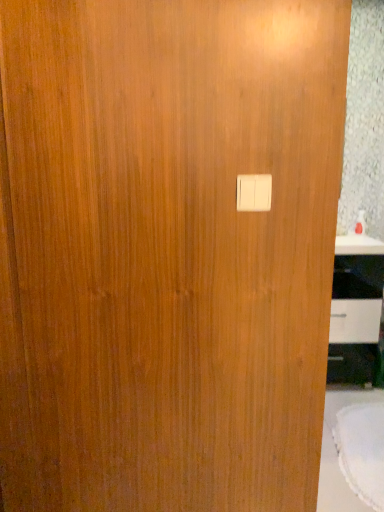
Locate an element on the screen. This screenshot has width=384, height=512. white glossy cabinet at right is located at coordinates (356, 321).

Describe the element at coordinates (356, 321) in the screenshot. I see `white glossy cabinet at right` at that location.

Identify the location of white plastic light switch at center. (254, 192).

From the image's perspective, does white plastic light switch at center appear lower than white fabric table at lower right?

No, from the image's perspective, white plastic light switch at center is not below white fabric table at lower right.

From a real-world perspective, is white plastic light switch at center located beneath white fabric table at lower right?

No, from a real-world perspective, white plastic light switch at center is not below white fabric table at lower right.

Choose the correct answer: Is white plastic light switch at center inside white fabric table at lower right or outside it?

white plastic light switch at center is not enclosed by white fabric table at lower right.

The width and height of the screenshot is (384, 512). In order to click on light switch in front of the white fabric table at lower right in this screenshot , I will do `click(254, 192)`.

Considering the sizes of objects white fabric table at lower right and white glossy cabinet at right in the image provided, who is wider, white fabric table at lower right or white glossy cabinet at right?

white fabric table at lower right.

How different are the orientations of white fabric table at lower right and white glossy cabinet at right in degrees?

They differ by 0.000441 degrees in their facing directions.

From the image's perspective, which is below, white fabric table at lower right or white glossy cabinet at right?

white fabric table at lower right is shown below in the image.

Based on the photo, is white fabric table at lower right not close to white glossy cabinet at right?

No, white fabric table at lower right is not far from white glossy cabinet at right.

From a real-world perspective, which object rests below the other?

white glossy cabinet at right, from a real-world perspective.

Is white glossy cabinet at right at the back of white plastic light switch at center?

white plastic light switch at center is not turned away from white glossy cabinet at right.

Is white plastic light switch at center next to white glossy cabinet at right and touching it?

No, white plastic light switch at center is not making contact with white glossy cabinet at right.

Which object is further away from the camera taking this photo, white plastic light switch at center or white glossy cabinet at right?

white glossy cabinet at right is behind.

Can you tell me how much white glossy cabinet at right and white fabric table at lower right differ in facing direction?

white glossy cabinet at right and white fabric table at lower right are facing 0.000441 degrees away from each other.

Considering the positions of objects white glossy cabinet at right and white fabric table at lower right in the image provided, who is more to the left, white glossy cabinet at right or white fabric table at lower right?

Positioned to the left is white fabric table at lower right.

Is white glossy cabinet at right outside of white fabric table at lower right?

Yes.

How many degrees apart are the facing directions of white fabric table at lower right and white plastic light switch at center?

1.01 degrees separate the facing orientations of white fabric table at lower right and white plastic light switch at center.

Choose the correct answer: Is white fabric table at lower right inside white plastic light switch at center or outside it?

The correct answer is: outside.

Considering the points (347, 423) and (237, 177), which point is behind, point (347, 423) or point (237, 177)?

Positioned behind is point (347, 423).

Can you tell me how much white glossy cabinet at right and white plastic light switch at center differ in facing direction?

white glossy cabinet at right and white plastic light switch at center are facing 1.01 degrees away from each other.

Is the position of white glossy cabinet at right more distant than that of white plastic light switch at center?

Yes, white glossy cabinet at right is behind white plastic light switch at center.

Based on their positions, is white glossy cabinet at right located to the left or right of white plastic light switch at center?

From the image, it's evident that white glossy cabinet at right is to the right of white plastic light switch at center.

From the picture: Is white glossy cabinet at right next to white plastic light switch at center and touching it?

No, white glossy cabinet at right is not beside white plastic light switch at center.

I want to click on light switch above the white fabric table at lower right (from a real-world perspective), so click(254, 192).

The width and height of the screenshot is (384, 512). Find the location of `cabinetry behind the white fabric table at lower right`. cabinetry behind the white fabric table at lower right is located at coordinates (356, 321).

From the image, which object appears to be nearer to white fabric table at lower right, white glossy cabinet at right or white plastic light switch at center?

The object closer to white fabric table at lower right is white glossy cabinet at right.

Considering their positions, is white fabric table at lower right positioned further to white plastic light switch at center than white glossy cabinet at right?

white glossy cabinet at right lies further to white plastic light switch at center than the other object.

Estimate the real-world distances between objects in this image. Which object is closer to white fabric table at lower right, white plastic light switch at center or white glossy cabinet at right?

white glossy cabinet at right lies closer to white fabric table at lower right than the other object.

Estimate the real-world distances between objects in this image. Which object is further from white glossy cabinet at right, white plastic light switch at center or white fabric table at lower right?

white plastic light switch at center lies further to white glossy cabinet at right than the other object.

Estimate the real-world distances between objects in this image. Which object is closer to white plastic light switch at center, white glossy cabinet at right or white fabric table at lower right?

white fabric table at lower right lies closer to white plastic light switch at center than the other object.

From the picture: Which object lies nearer to the anchor point white glossy cabinet at right, white fabric table at lower right or white plastic light switch at center?

Based on the image, white fabric table at lower right appears to be nearer to white glossy cabinet at right.

This screenshot has height=512, width=384. What are the coordinates of `round table between white plastic light switch at center and white glossy cabinet at right from front to back` in the screenshot? It's located at (362, 450).